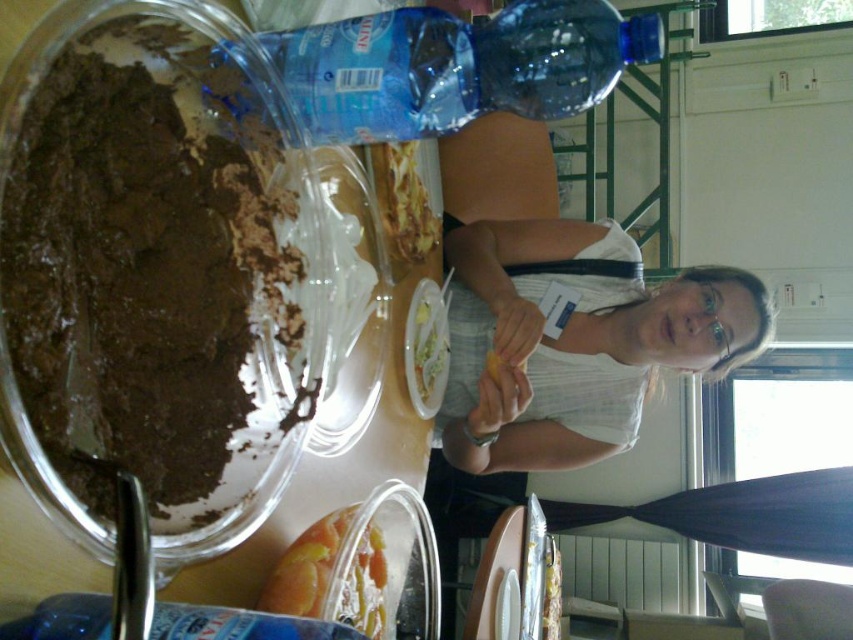
You are at the center of the table and want to place a napkin in the translucent plastic container at lower center. According to the coordinates provided, in which direction should you move relative to your current position?

The translucent plastic container at lower center is located at coordinates point (306, 566), so you should move towards the lower center direction from your current position at the table center to place the napkin.

You are a server at a buffet. You need to place a new dessert plate between the dark matte chocolate cake at left and the white fabric shirt at upper right. Can you fit it there?

The dark matte chocolate cake at left and white fabric shirt at upper right are 24.83 inches apart, so yes, you can fit a dessert plate between them since the space is sufficient.